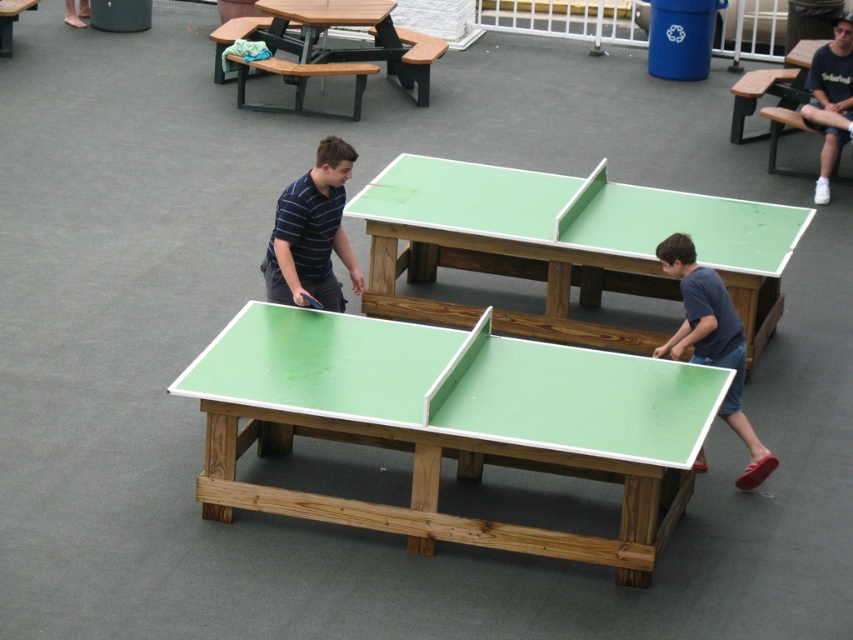
You are standing at the center of the image. Where is the green matte table tennis table at center located relative to your position?

The green matte table tennis table at center is located at point (451, 422) relative to your position.

Based on the scene, if you were standing at the position of the blue fabric shirt at lower right, which direction should you look to see the green matte table tennis table at center?

The green matte table tennis table at center is to the left of the blue fabric shirt at lower right, so you should look to your left to see it.